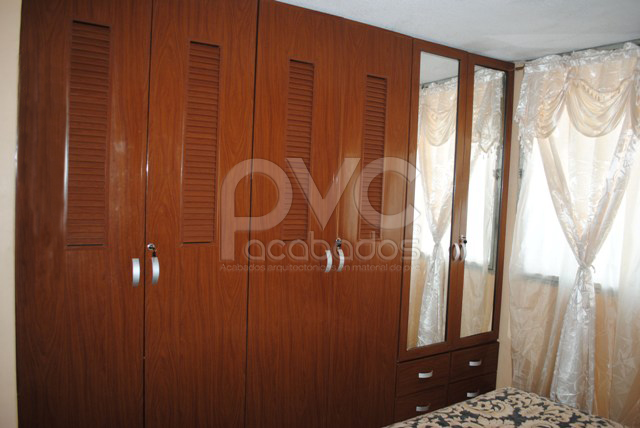
This screenshot has width=640, height=428. I want to click on mirror, so click(x=491, y=80), click(x=440, y=71).